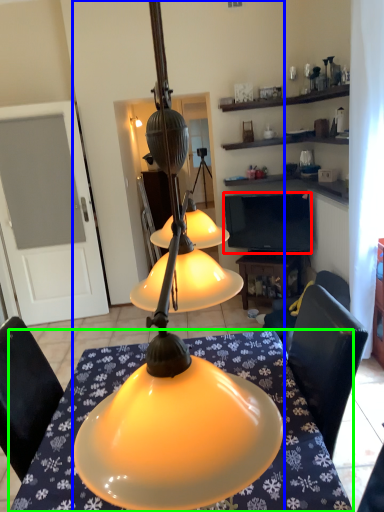
Question: Estimate the real-world distances between objects in this image. Which object is farther from television (highlighted by a red box), lamp (highlighted by a blue box) or desk (highlighted by a green box)?

Choices:
 (A) lamp
 (B) desk

Answer: (A)